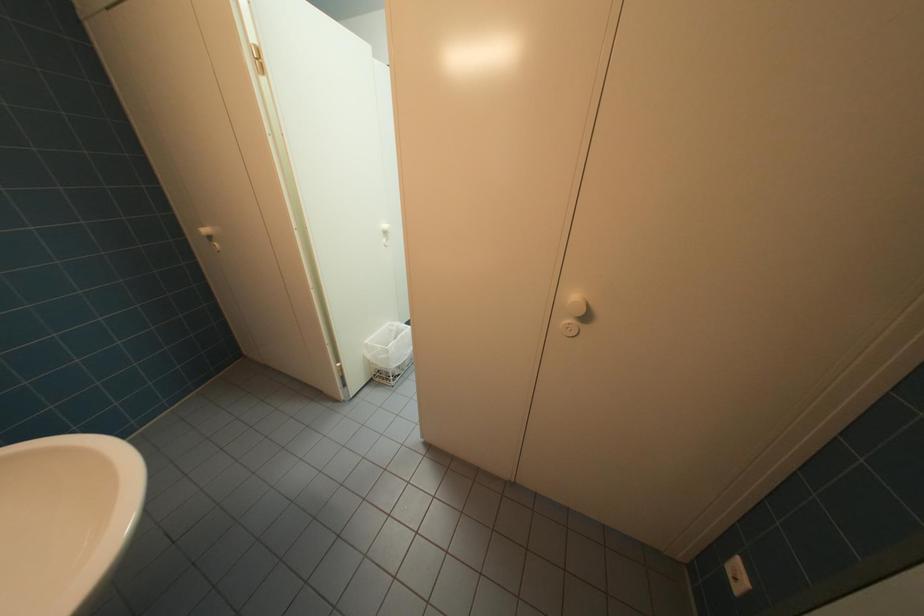
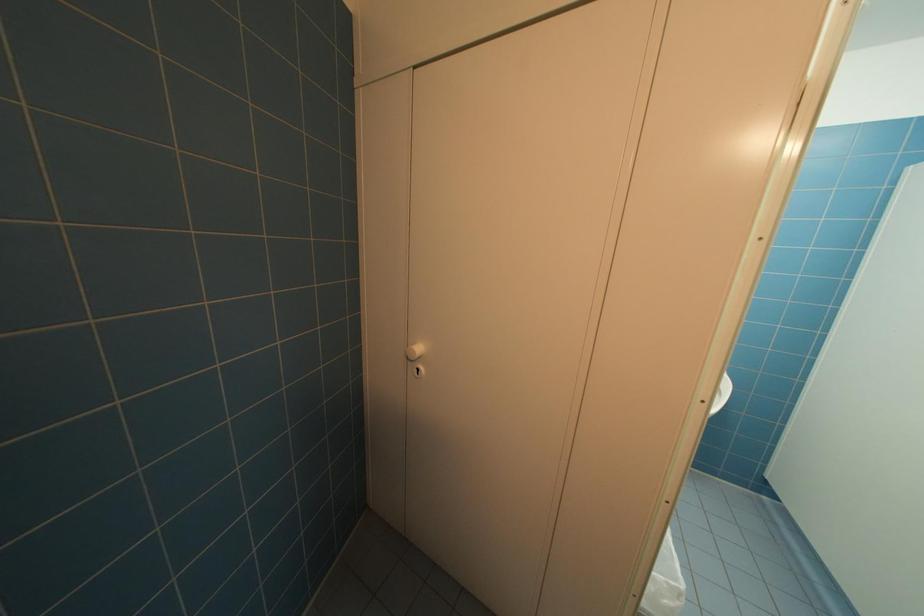
What movement of the cameraman would produce the second image?

The cameraman walked toward left, forward.